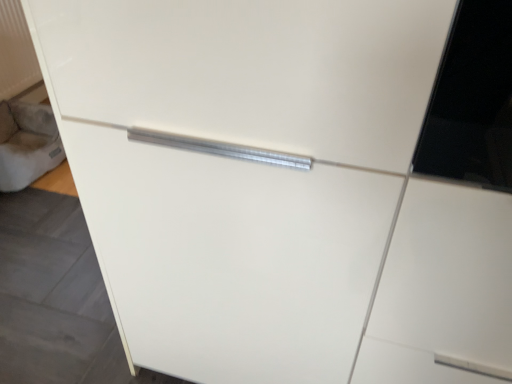
Question: Is white textured radiator at upper left wider or thinner than suede-like gray cushion at lower left?

Choices:
 (A) thin
 (B) wide

Answer: (A)

Question: Considering the positions of point tap(0, 9) and point tap(9, 178), is point tap(0, 9) closer or farther from the camera than point tap(9, 178)?

Choices:
 (A) closer
 (B) farther

Answer: (B)

Question: Is white textured radiator at upper left in front of or behind suede-like gray cushion at lower left in the image?

Choices:
 (A) behind
 (B) front

Answer: (A)

Question: Considering the positions of suede-like gray cushion at lower left and white textured radiator at upper left in the image, is suede-like gray cushion at lower left bigger or smaller than white textured radiator at upper left?

Choices:
 (A) big
 (B) small

Answer: (A)

Question: Is suede-like gray cushion at lower left wider or thinner than white textured radiator at upper left?

Choices:
 (A) thin
 (B) wide

Answer: (B)

Question: From a real-world perspective, is suede-like gray cushion at lower left physically located above or below white textured radiator at upper left?

Choices:
 (A) below
 (B) above

Answer: (A)

Question: From the image's perspective, relative to white textured radiator at upper left, is suede-like gray cushion at lower left above or below?

Choices:
 (A) below
 (B) above

Answer: (A)